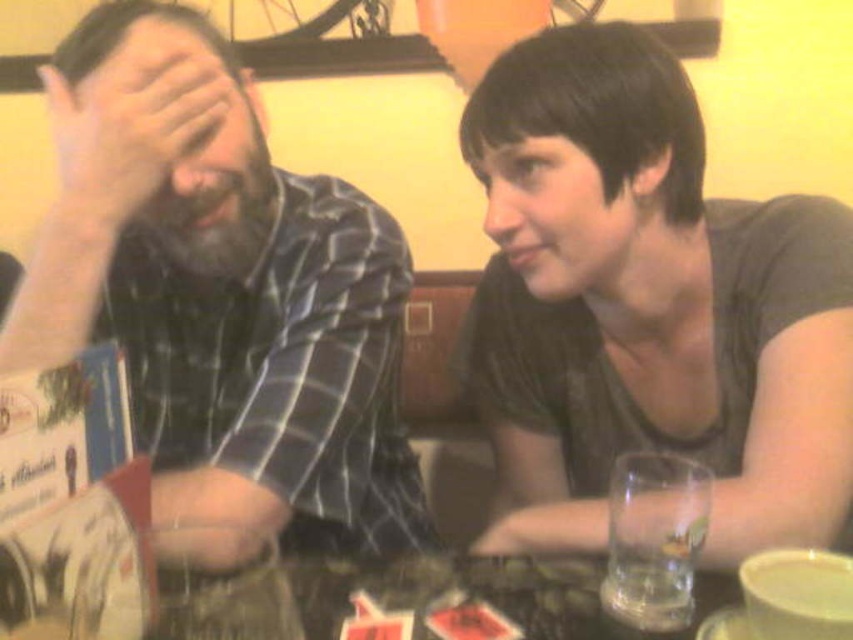
Question: In this image, where is plaid shirt at left located relative to clear glass at lower right?

Choices:
 (A) above
 (B) below

Answer: (A)

Question: Is dark gray shirt at center behind clear glass at lower right?

Choices:
 (A) no
 (B) yes

Answer: (B)

Question: Is plaid shirt at left wider than matte skin hand at center?

Choices:
 (A) yes
 (B) no

Answer: (A)

Question: Which object appears farthest from the camera in this image?

Choices:
 (A) dark gray shirt at center
 (B) yellow matte cup at lower right

Answer: (A)

Question: Which of the following is the farthest from the observer?

Choices:
 (A) matte skin hand at center
 (B) yellow matte cup at lower right
 (C) plaid shirt at left
 (D) dark gray shirt at center

Answer: (A)

Question: Among these points, which one is farthest from the camera?

Choices:
 (A) (817, 621)
 (B) (62, 42)

Answer: (B)